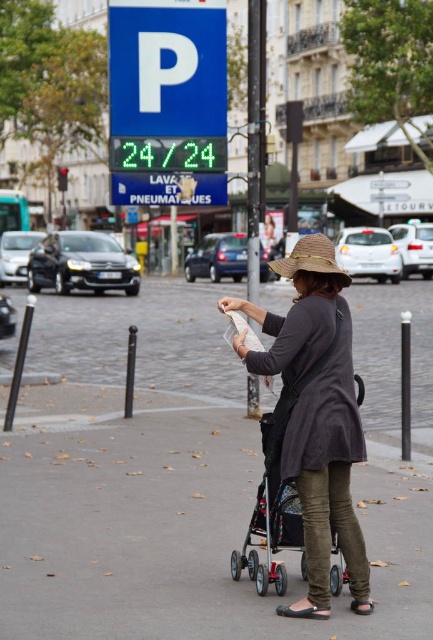
Can you confirm if matte gray coat at center is bigger than brown straw hat at center?

No, matte gray coat at center is not bigger than brown straw hat at center.

Does point (367, 592) lie in front of point (342, 275)?

No.

In order to click on matte gray coat at center in this screenshot , I will do `click(316, 416)`.

Is smooth concrete pavement at center further to the viewer compared to brown straw hat at center?

Yes, smooth concrete pavement at center is behind brown straw hat at center.

Describe the element at coordinates (174, 525) in the screenshot. Image resolution: width=433 pixels, height=640 pixels. I see `smooth concrete pavement at center` at that location.

Describe the element at coordinates (174, 525) in the screenshot. I see `smooth concrete pavement at center` at that location.

The height and width of the screenshot is (640, 433). Find the location of `smooth concrete pavement at center`. smooth concrete pavement at center is located at coordinates (174, 525).

Does matte gray coat at center appear over metallic silver baby carriage at center?

Yes, matte gray coat at center is above metallic silver baby carriage at center.

Does matte gray coat at center lie in front of metallic silver baby carriage at center?

That is True.

Which is behind, point (316, 252) or point (294, 484)?

Positioned behind is point (294, 484).

Where is `matte gray coat at center`? matte gray coat at center is located at coordinates (316, 416).